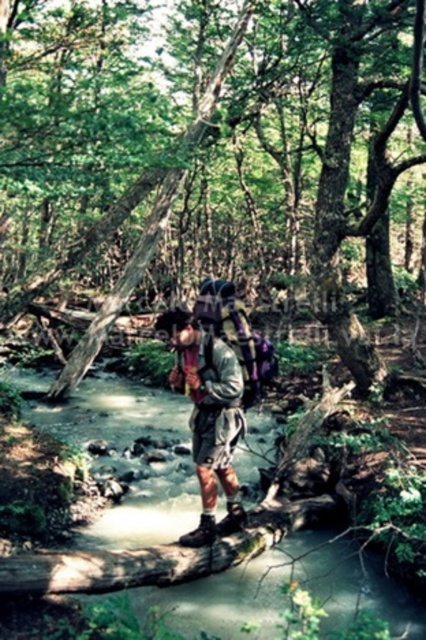
Does rough bark tree at center have a smaller size compared to camouflage fabric backpack at center?

No, rough bark tree at center is not smaller than camouflage fabric backpack at center.

Is rough bark tree at center to the right of camouflage fabric backpack at center from the viewer's perspective?

Correct, you'll find rough bark tree at center to the right of camouflage fabric backpack at center.

Who is more forward, (362, 380) or (212, 477)?

Point (212, 477) is in front.

I want to click on rough bark tree at center, so click(x=271, y=163).

Is rough bark tree at center further to the viewer compared to clear water at stream center?

Yes, rough bark tree at center is further from the viewer.

Between point (319, 93) and point (256, 573), which one is positioned in front?

Point (256, 573) is more forward.

Identify the location of rough bark tree at center. The image size is (426, 640). (271, 163).

Is clear water at stream center to the left of camouflage fabric backpack at center from the viewer's perspective?

Yes, clear water at stream center is to the left of camouflage fabric backpack at center.

Where is `clear water at stream center`? The height and width of the screenshot is (640, 426). clear water at stream center is located at coordinates (281, 595).

You are a GUI agent. You are given a task and a screenshot of the screen. Output one action in this format:
    pyautogui.click(x=<x>, y=<y>)
    Task: Click on the clear water at stream center
    
    Given the screenshot: What is the action you would take?
    pyautogui.click(x=281, y=595)